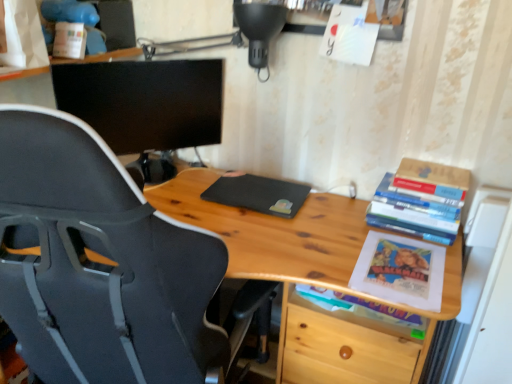
Identify the location of empty space that is to the right of black matte monitor at upper left. tap(214, 202).